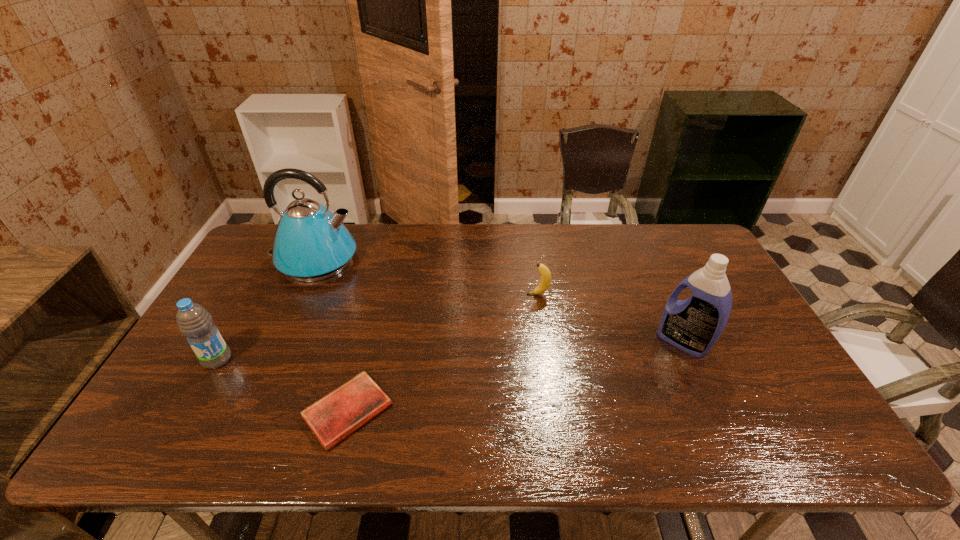
Find the location of `vacant space at the far edge of the desktop`. vacant space at the far edge of the desktop is located at coordinates (499, 237).

The width and height of the screenshot is (960, 540). In the image, there is a desktop. What are the coordinates of `free space at the near edge` in the screenshot? It's located at (214, 429).

In order to click on vacant space at the left edge in this screenshot , I will do `click(208, 371)`.

At what (x,y) coordinates should I click in order to perform the action: click on blank region between the nearest object and the fourth object from left to right. Please return your answer as a coordinate pair (x, y). This screenshot has height=540, width=960. Looking at the image, I should click on (443, 353).

Locate an element on the screen. blank region between the second shortest object and the diary is located at coordinates (443, 353).

Image resolution: width=960 pixels, height=540 pixels. What are the coordinates of `free space between the nearest object and the second object from right to left` in the screenshot? It's located at (443, 353).

Image resolution: width=960 pixels, height=540 pixels. Find the location of `free space between the second object from right to left and the water bottle`. free space between the second object from right to left and the water bottle is located at coordinates (377, 327).

You are a GUI agent. You are given a task and a screenshot of the screen. Output one action in this format:
    pyautogui.click(x=<x>, y=<y>)
    Task: Click on the free space between the detergent and the second object from right to left
    This screenshot has width=960, height=540.
    Given the screenshot: What is the action you would take?
    pyautogui.click(x=611, y=318)

This screenshot has width=960, height=540. Identify the location of free space between the farthest object and the detergent. (499, 301).

Where is `vacant region between the kettle and the detergent`? The image size is (960, 540). vacant region between the kettle and the detergent is located at coordinates (499, 301).